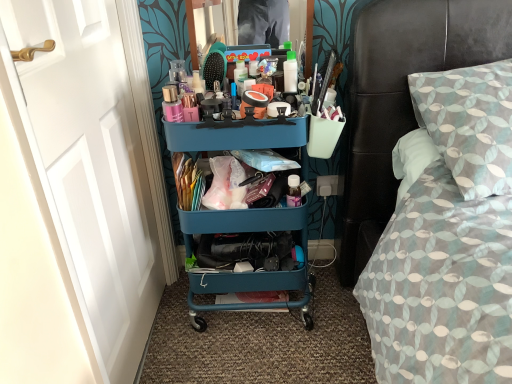
Identify the location of vacant area that lies in front of teal plastic cart at center. The width and height of the screenshot is (512, 384). (256, 357).